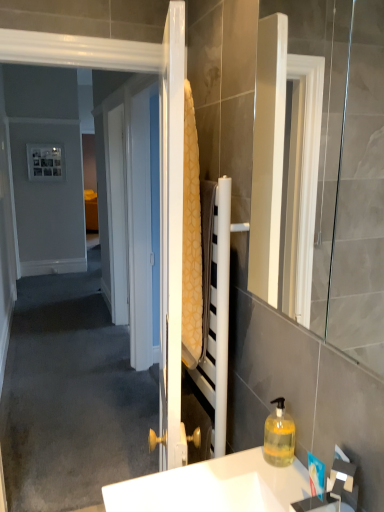
Question: Is yellow textured towel at center taller or shorter than white glossy sink at lower center?

Choices:
 (A) short
 (B) tall

Answer: (B)

Question: From the image's perspective, is yellow textured towel at center above or below white glossy sink at lower center?

Choices:
 (A) below
 (B) above

Answer: (B)

Question: Considering the real-world distances, which object is farthest from the translucent yellow liquid at lower right?

Choices:
 (A) white glossy mirror at right
 (B) yellow textured towel at center
 (C) white glossy sink at lower center

Answer: (A)

Question: Which object is positioned farthest from the white glossy mirror at right?

Choices:
 (A) white glossy sink at lower center
 (B) yellow textured towel at center
 (C) translucent yellow liquid at lower right

Answer: (A)